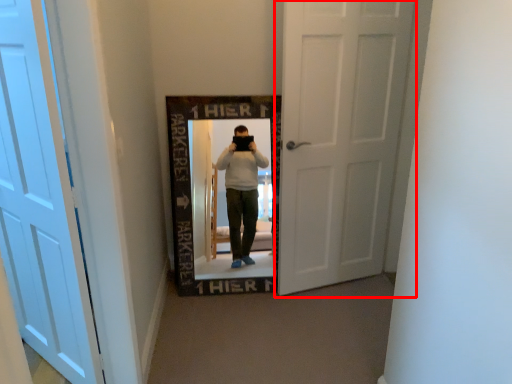
Question: From the image's perspective, what is the correct spatial relationship of door (annotated by the red box) in relation to door?

Choices:
 (A) below
 (B) above

Answer: (B)